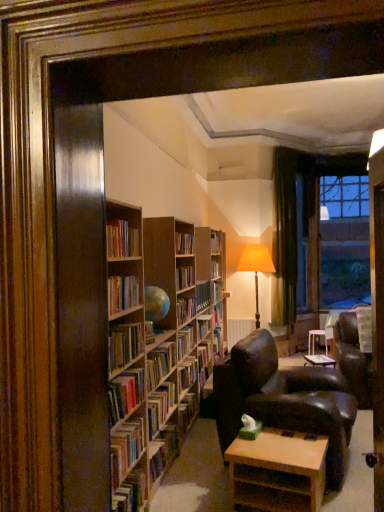
Question: Is hardcover book at lower left, which is the fifth book from top to bottom, far away from wooden bookshelf at center, the 2th book viewed from the top?

Choices:
 (A) yes
 (B) no

Answer: (A)

Question: Can you confirm if hardcover book at lower left, placed as the 1th book when sorted from bottom to top, is thinner than wooden bookshelf at center, placed as the 4th book when sorted from bottom to top?

Choices:
 (A) yes
 (B) no

Answer: (B)

Question: Does hardcover book at lower left, which is the fifth book from top to bottom, have a greater width compared to wooden bookshelf at center, placed as the 4th book when sorted from bottom to top?

Choices:
 (A) yes
 (B) no

Answer: (A)

Question: Is hardcover book at lower left, which is the fifth book from top to bottom, positioned with its back to wooden bookshelf at center, the 2th book viewed from the top?

Choices:
 (A) yes
 (B) no

Answer: (B)

Question: Can you confirm if hardcover book at lower left, which is the fifth book from top to bottom, is positioned to the left of wooden bookshelf at center, placed as the 4th book when sorted from bottom to top?

Choices:
 (A) yes
 (B) no

Answer: (B)

Question: Is hardcover book at lower left, placed as the 1th book when sorted from bottom to top, completely or partially outside of wooden bookshelf at center, the 2th book viewed from the top?

Choices:
 (A) no
 (B) yes

Answer: (B)

Question: Does hardcover books at center, the second book ordered from the bottom, contain leather armchair at center?

Choices:
 (A) yes
 (B) no

Answer: (B)

Question: Is the position of hardcover books at center, acting as the fourth book starting from the top, more distant than that of leather armchair at center?

Choices:
 (A) yes
 (B) no

Answer: (B)

Question: Can you confirm if hardcover books at center, the second book ordered from the bottom, is bigger than leather armchair at center?

Choices:
 (A) yes
 (B) no

Answer: (B)

Question: Is hardcover books at center, the second book ordered from the bottom, completely or partially outside of leather armchair at center?

Choices:
 (A) yes
 (B) no

Answer: (A)

Question: Is hardcover books at center, acting as the fourth book starting from the top, in contact with leather armchair at center?

Choices:
 (A) no
 (B) yes

Answer: (A)

Question: Would you consider hardcover books at center, the second book ordered from the bottom, to be distant from leather armchair at center?

Choices:
 (A) no
 (B) yes

Answer: (A)

Question: Is wooden bookshelf at center, the 2th book viewed from the top, smaller than hardcover books at center, positioned as the 3th book in top-to-bottom order?

Choices:
 (A) yes
 (B) no

Answer: (A)